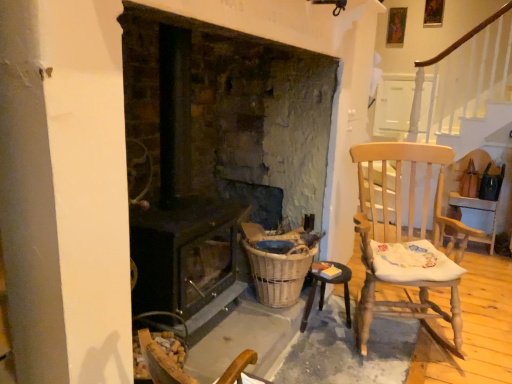
Question: Should I look upward or downward to see dark brown wood stove at center?

Choices:
 (A) down
 (B) up

Answer: (B)

Question: Should I look upward or downward to see light wood rocking chair at right?

Choices:
 (A) down
 (B) up

Answer: (A)

Question: Is woven brown basket at lower center taller than light wood rocking chair at right?

Choices:
 (A) yes
 (B) no

Answer: (B)

Question: Is woven brown basket at lower center thinner than light wood rocking chair at right?

Choices:
 (A) no
 (B) yes

Answer: (B)

Question: Is woven brown basket at lower center bigger than light wood rocking chair at right?

Choices:
 (A) yes
 (B) no

Answer: (B)

Question: Is woven brown basket at lower center with light wood rocking chair at right?

Choices:
 (A) yes
 (B) no

Answer: (B)

Question: From a real-world perspective, is woven brown basket at lower center over light wood rocking chair at right?

Choices:
 (A) no
 (B) yes

Answer: (A)

Question: Is woven brown basket at lower center at the right side of light wood rocking chair at right?

Choices:
 (A) no
 (B) yes

Answer: (A)

Question: Can you confirm if light wood rocking chair at right is bigger than wooden table at lower right?

Choices:
 (A) yes
 (B) no

Answer: (A)

Question: Is light wood rocking chair at right oriented away from wooden table at lower right?

Choices:
 (A) no
 (B) yes

Answer: (A)

Question: Is light wood rocking chair at right shorter than wooden table at lower right?

Choices:
 (A) no
 (B) yes

Answer: (A)

Question: Is light wood rocking chair at right next to wooden table at lower right?

Choices:
 (A) no
 (B) yes

Answer: (A)

Question: Does light wood rocking chair at right come behind wooden table at lower right?

Choices:
 (A) no
 (B) yes

Answer: (A)

Question: Does light wood rocking chair at right come in front of wooden table at lower right?

Choices:
 (A) yes
 (B) no

Answer: (A)

Question: Is dark brown wood stove at center outside wooden table at lower right?

Choices:
 (A) no
 (B) yes

Answer: (B)